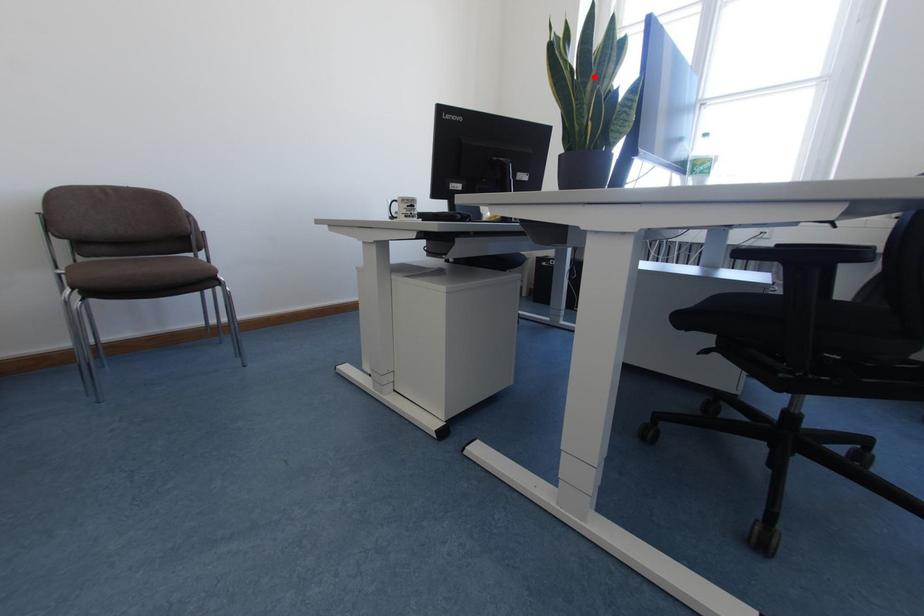
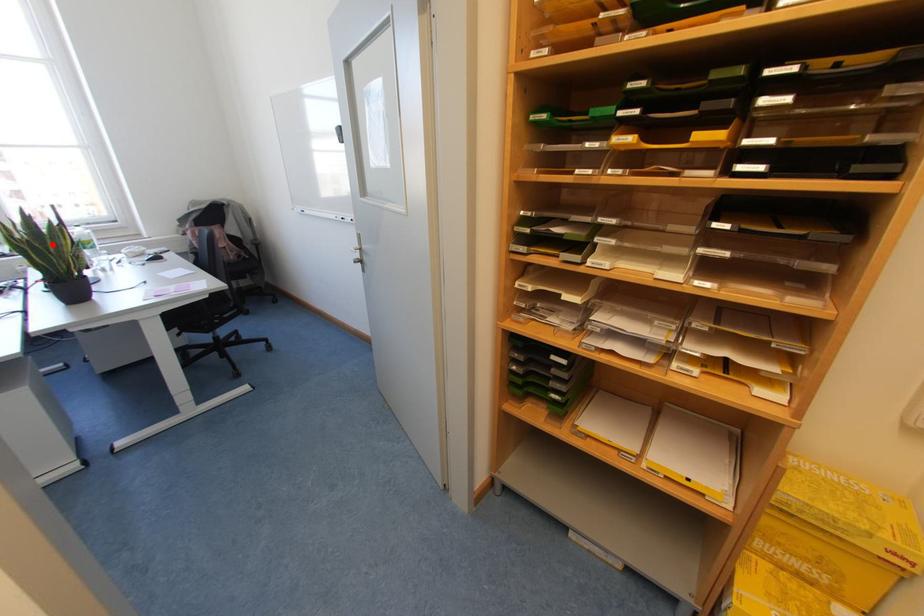
I am providing you with two images of the same scene from different viewpoints. A red point is marked on the first image and another point is marked on the second image. Do the highlighted points in image1 and image2 indicate the same real-world spot?

Yes